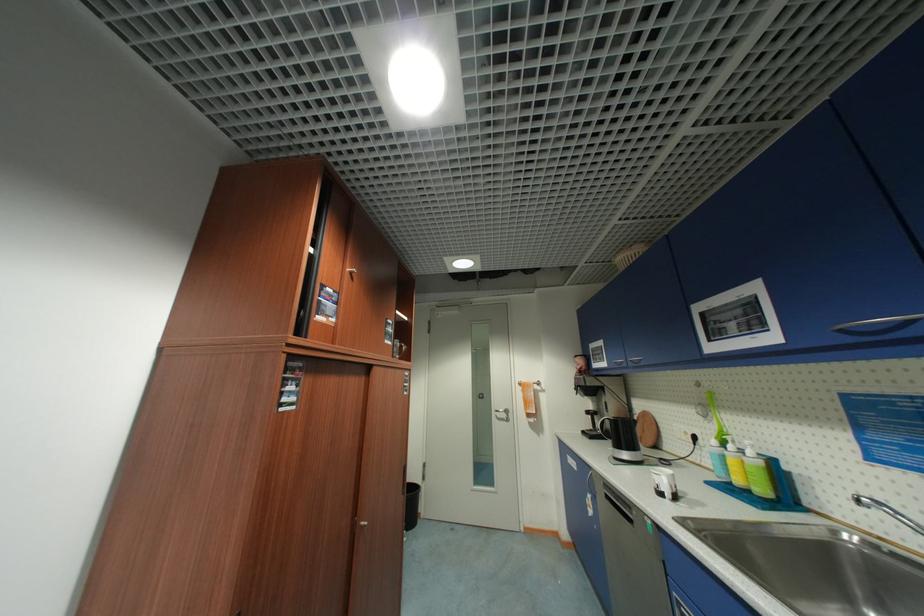
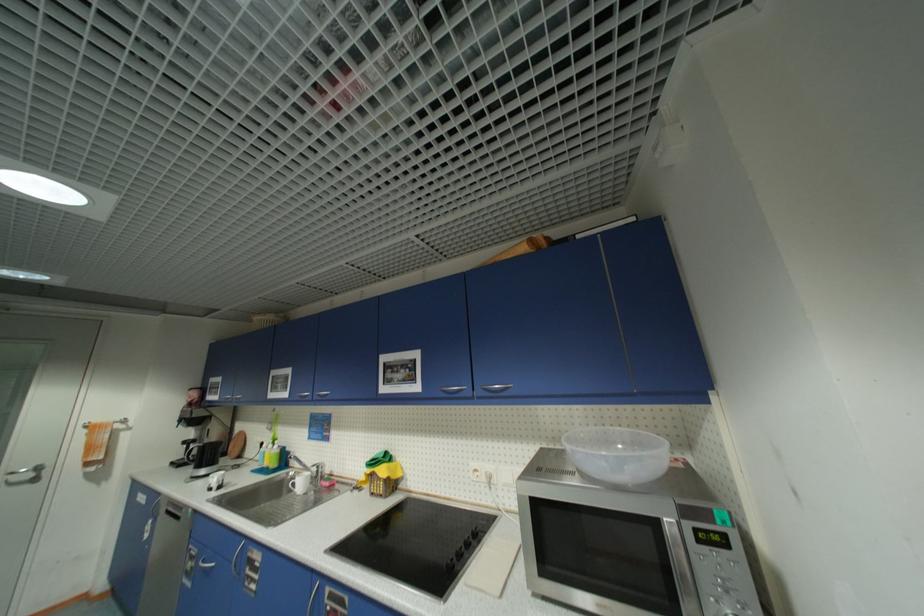
Find the pixel in the second image that matches (500,415) in the first image.

(7, 479)